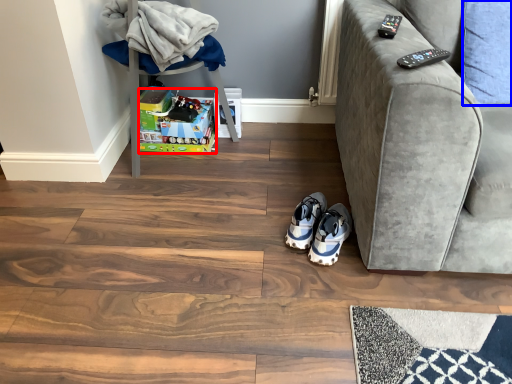
Question: Which of the following is the farthest to the observer, toy (highlighted by a red box) or pillow (highlighted by a blue box)?

Choices:
 (A) toy
 (B) pillow

Answer: (A)